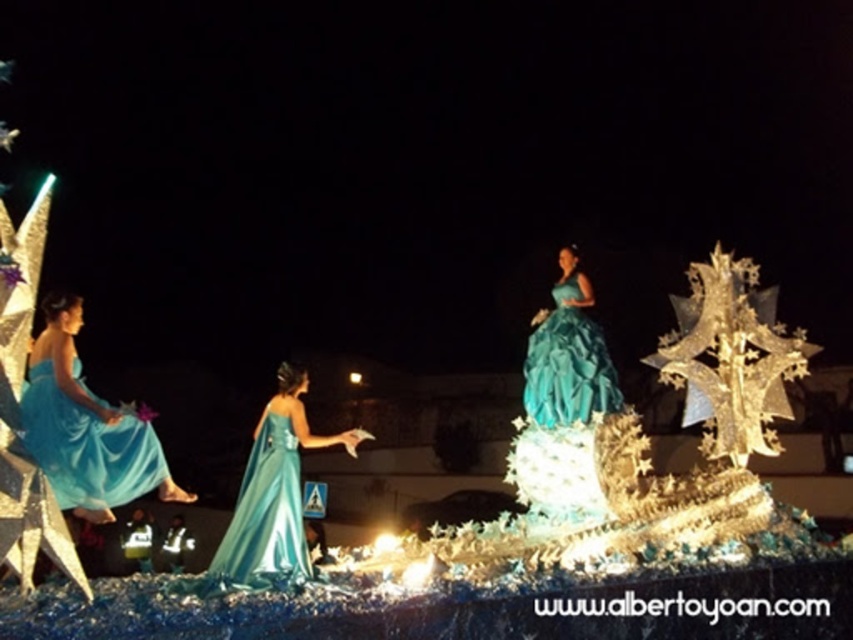
You are a photographer trying to capture a clear shot of the satin teal gown at center without the matte blue dress at left blocking it. Based on their positions, is this possible?

→ The matte blue dress at left is in front of the satin teal gown at center, so it is blocking the view. To capture a clear shot of the satin teal gown at center without obstruction, you would need to adjust your angle or position to avoid the matte blue dress at left.

Looking at this image, in the festive float scene, there are two performers wearing teal satin gowns. One is labeled as the satin teal gown at center and the other as the teal satin gown at center. Which of these two gowns is larger?

The satin teal gown at center is larger than the teal satin gown at center.